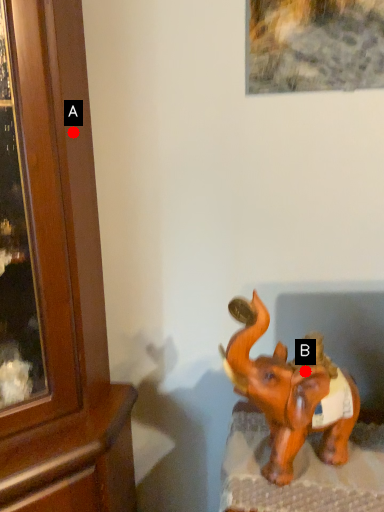
Question: Two points are circled on the image, labeled by A and B beside each circle. Which point appears closest to the camera in this image?

Choices:
 (A) A is closer
 (B) B is closer

Answer: (B)